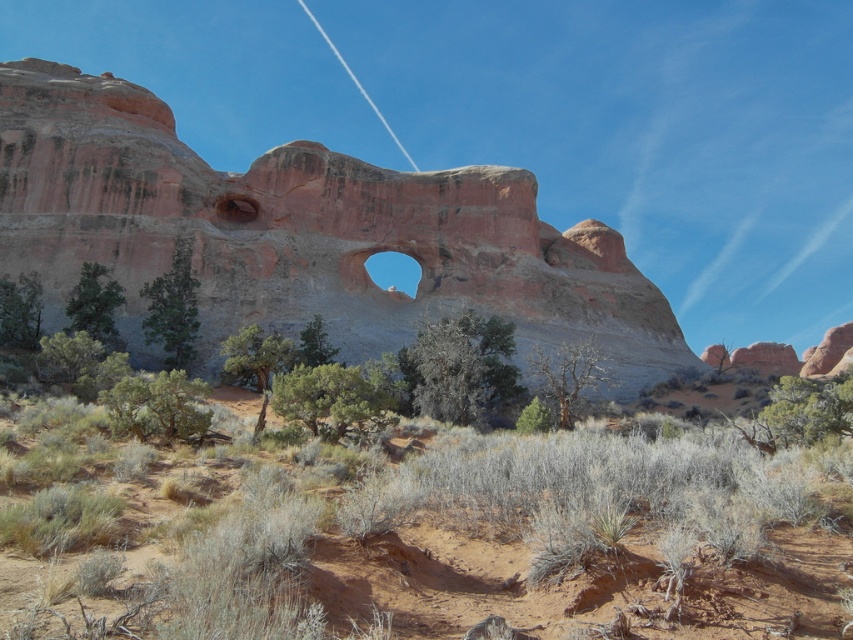
Question: Is desert shrubs at center thinner than rustic stone hole at center?

Choices:
 (A) yes
 (B) no

Answer: (B)

Question: Which object is the farthest from the rustic sandstone arch at center?

Choices:
 (A) rustic stone hole at center
 (B) desert shrubs at center

Answer: (B)

Question: Which point is closer to the camera?

Choices:
 (A) (241, 198)
 (B) (497, 618)

Answer: (B)

Question: Which point is closer to the camera?

Choices:
 (A) click(x=242, y=200)
 (B) click(x=134, y=96)

Answer: (A)

Question: Considering the relative positions of rustic sandstone arch at center and rustic stone hole at center in the image provided, where is rustic sandstone arch at center located with respect to rustic stone hole at center?

Choices:
 (A) right
 (B) left

Answer: (A)

Question: Can you confirm if desert shrubs at center is smaller than rustic sandstone arch at center?

Choices:
 (A) yes
 (B) no

Answer: (A)